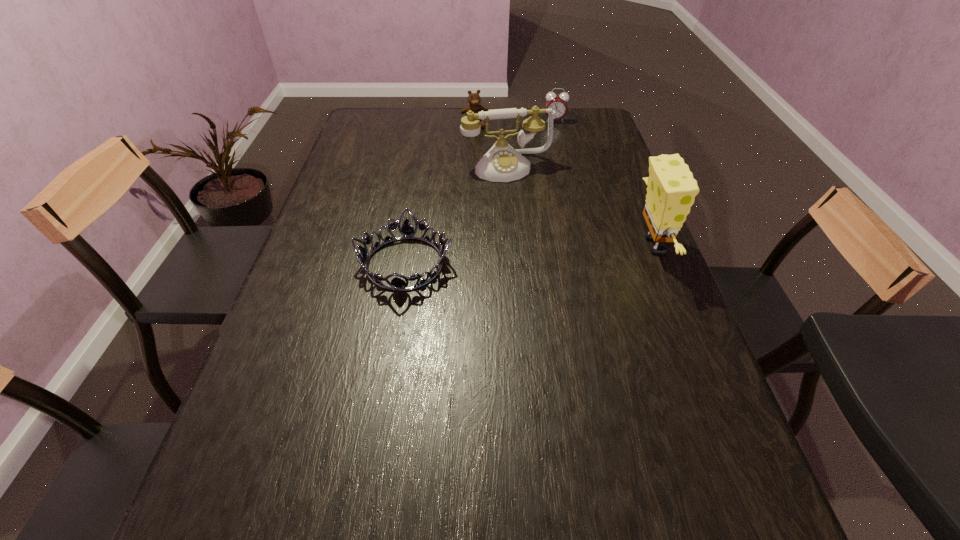
Locate an element on the screen. This screenshot has width=960, height=540. sponge that is at the right edge is located at coordinates (671, 191).

This screenshot has width=960, height=540. Identify the location of alarm clock positioned at the right edge. (558, 103).

Locate an element on the screen. This screenshot has height=540, width=960. object positioned at the far right corner is located at coordinates (558, 103).

I want to click on vacant area at the far edge, so click(418, 135).

In the image, there is a desktop. Where is `vacant space at the near edge`? This screenshot has height=540, width=960. vacant space at the near edge is located at coordinates (412, 486).

The height and width of the screenshot is (540, 960). What are the coordinates of `vacant area at the left edge of the desktop` in the screenshot? It's located at (324, 311).

This screenshot has width=960, height=540. Identify the location of free space at the right edge of the desktop. (614, 213).

Where is `vacant space at the far left corner`? The height and width of the screenshot is (540, 960). vacant space at the far left corner is located at coordinates (375, 139).

In the image, there is a desktop. At what (x,y) coordinates should I click in order to perform the action: click on vacant region at the far right corner. Please return your answer as a coordinate pair (x, y). Looking at the image, I should click on (584, 135).

Identify the location of free space between the sponge and the second object from right to left. The image size is (960, 540). (604, 184).